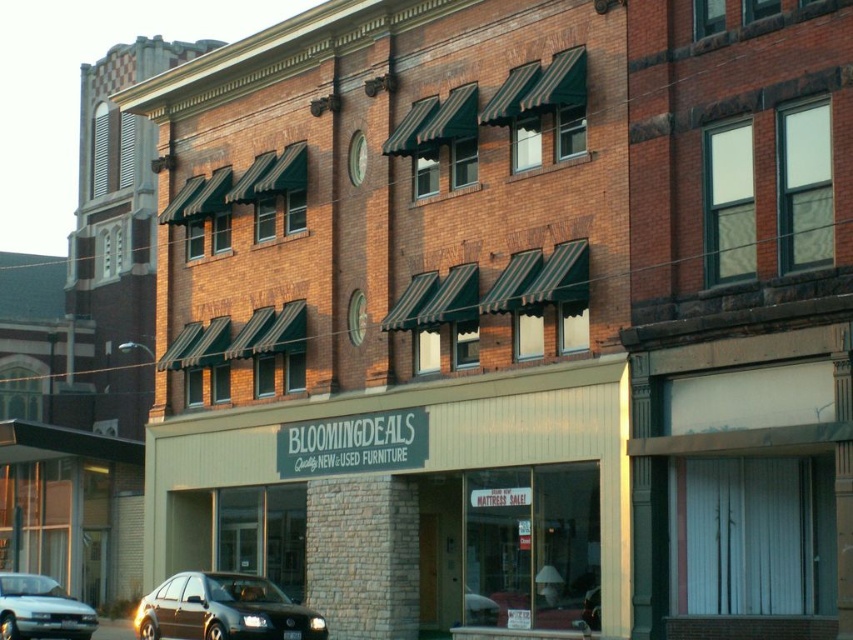
Question: Which of the following is the closest to the observer?

Choices:
 (A) (202, 605)
 (B) (77, 602)

Answer: (A)

Question: Among these objects, which one is nearest to the camera?

Choices:
 (A) satin black sedan at lower left
 (B) silver metallic sedan at lower left

Answer: (A)

Question: Is satin black sedan at lower left below silver metallic sedan at lower left?

Choices:
 (A) yes
 (B) no

Answer: (B)

Question: Does satin black sedan at lower left appear under silver metallic sedan at lower left?

Choices:
 (A) yes
 (B) no

Answer: (B)

Question: Which point is closer to the camera taking this photo?

Choices:
 (A) (202, 634)
 (B) (16, 634)

Answer: (A)

Question: From the image, what is the correct spatial relationship of satin black sedan at lower left in relation to silver metallic sedan at lower left?

Choices:
 (A) below
 (B) above

Answer: (B)